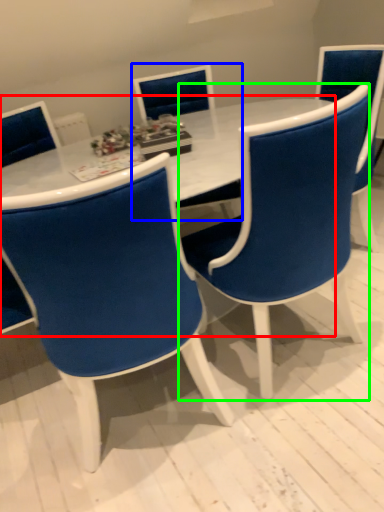
Question: Based on their relative distances, which object is farther from table (highlighted by a red box)? Choose from chair (highlighted by a blue box) and chair (highlighted by a green box).

Choices:
 (A) chair
 (B) chair

Answer: (A)